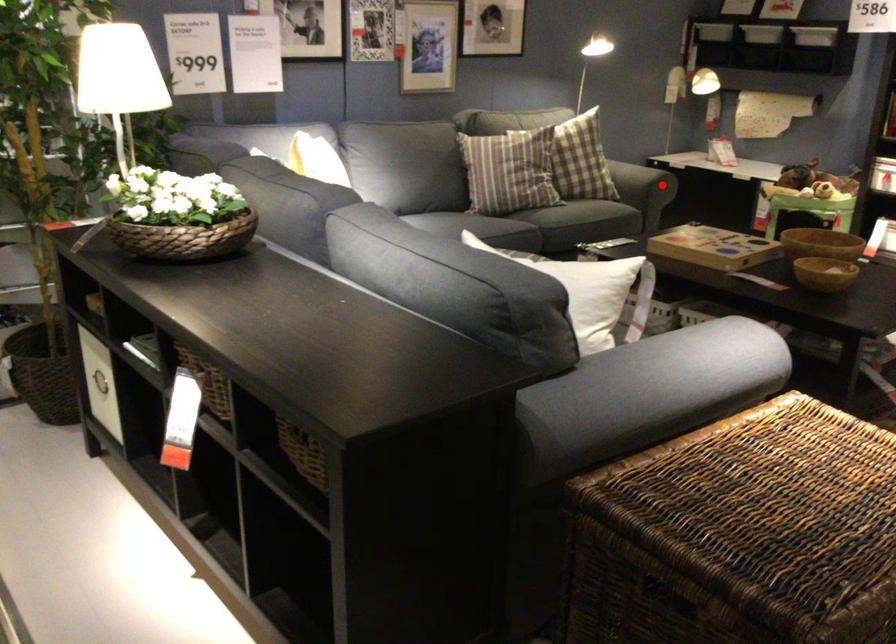
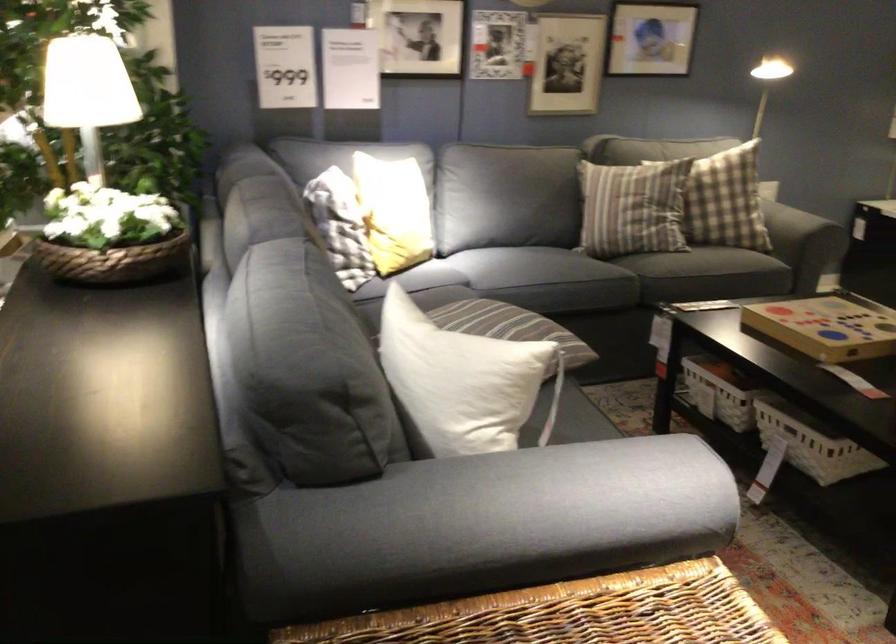
Question: I am providing you with two images of the same scene from different viewpoints. Image1 has a red point marked. In image2, the corresponding 3D location appears at what relative position? Reply with the corresponding letter.

Choices:
 (A) Closer
 (B) Farther

Answer: (A)